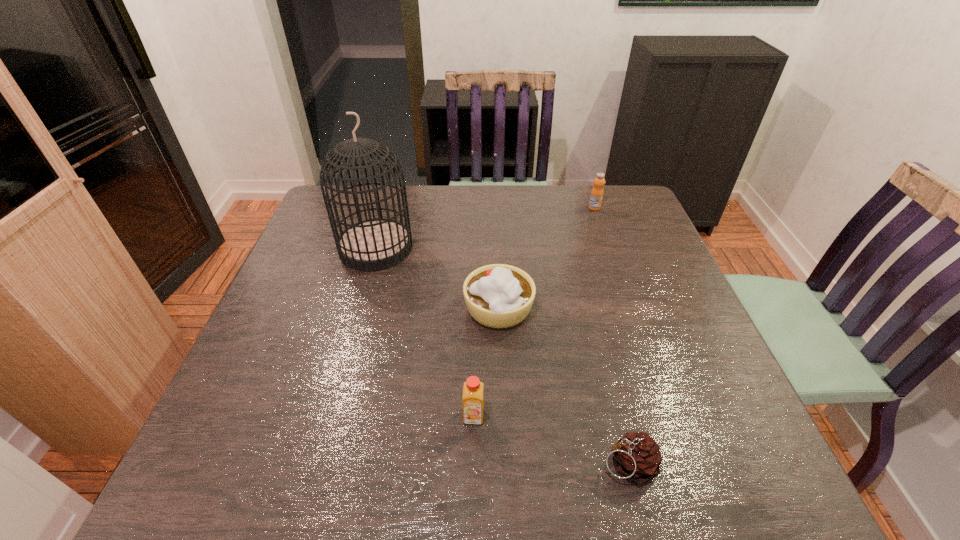
In order to click on object that is positioned at the right edge in this screenshot , I will do `click(596, 196)`.

At what (x,y) coordinates should I click in order to perform the action: click on object present at the far left corner. Please return your answer as a coordinate pair (x, y). Image resolution: width=960 pixels, height=540 pixels. Looking at the image, I should click on (376, 244).

What are the coordinates of `object that is at the far right corner` in the screenshot? It's located at (596, 196).

Where is `free region at the far edge of the desktop`? free region at the far edge of the desktop is located at coordinates (505, 214).

Image resolution: width=960 pixels, height=540 pixels. In order to click on free point at the left edge in this screenshot , I will do `click(284, 380)`.

In the image, there is a desktop. At what (x,y) coordinates should I click in order to perform the action: click on vacant space at the right edge. Please return your answer as a coordinate pair (x, y). This screenshot has height=540, width=960. Looking at the image, I should click on (682, 424).

Where is `free location at the near left corner`? free location at the near left corner is located at coordinates (265, 449).

In the image, there is a desktop. Where is `vacant space at the far right corner`? vacant space at the far right corner is located at coordinates 596,224.

Find the location of a particular element. vacant area that lies between the fourth object from left to right and the tallest object is located at coordinates (502, 356).

You are a GUI agent. You are given a task and a screenshot of the screen. Output one action in this format:
    pyautogui.click(x=<x>, y=<y>)
    Task: Click on the free spot between the birdcage and the third farthest object
    
    Given the screenshot: What is the action you would take?
    pyautogui.click(x=438, y=278)